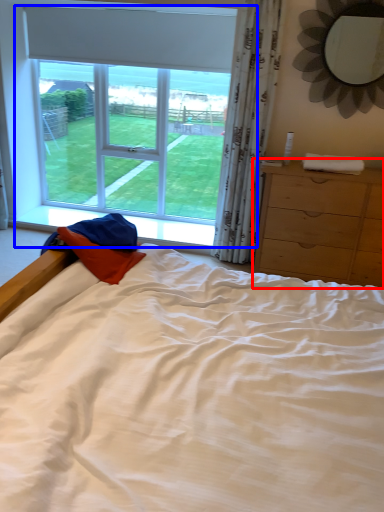
Question: Which object appears closest to the camera in this image, chest of drawers (highlighted by a red box) or window (highlighted by a blue box)?

Choices:
 (A) chest of drawers
 (B) window

Answer: (A)